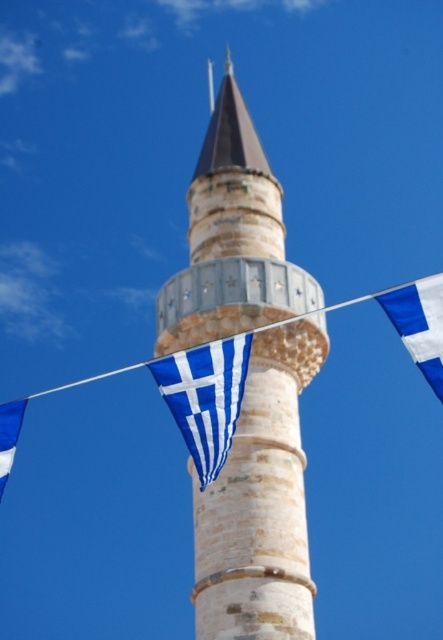
Question: Among these points, which one is nearest to the camera?

Choices:
 (A) (8, 416)
 (B) (247, 476)
 (C) (440, 348)
 (D) (194, 451)

Answer: (C)

Question: Is stone minaret at center behind blue fabric flag at right?

Choices:
 (A) yes
 (B) no

Answer: (A)

Question: Estimate the real-world distances between objects in this image. Which object is closer to the blue striped flag at center?

Choices:
 (A) blue fabric flag at lower left
 (B) blue fabric flag at right
 (C) stone minaret at center

Answer: (A)

Question: Is stone minaret at center wider than blue fabric flag at lower left?

Choices:
 (A) no
 (B) yes

Answer: (B)

Question: Does stone minaret at center have a larger size compared to blue fabric flag at lower left?

Choices:
 (A) no
 (B) yes

Answer: (B)

Question: Which of the following is the closest to the observer?

Choices:
 (A) (x=198, y=246)
 (B) (x=0, y=442)
 (C) (x=419, y=285)

Answer: (C)